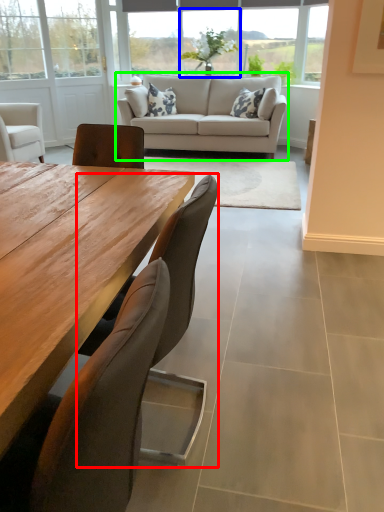
Question: Considering the real-world distances, which object is farthest from chair (highlighted by a red box)? window (highlighted by a blue box) or studio couch (highlighted by a green box)?

Choices:
 (A) window
 (B) studio couch

Answer: (A)